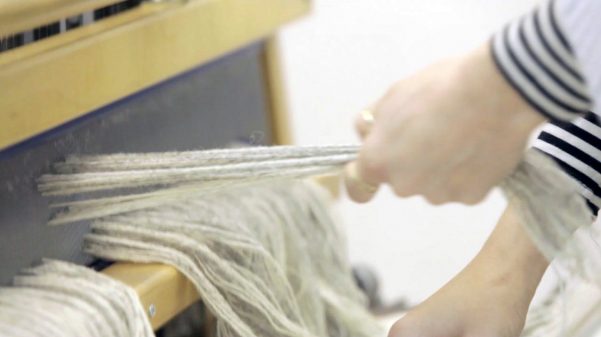
The height and width of the screenshot is (337, 601). I want to click on black board, so click(x=191, y=120).